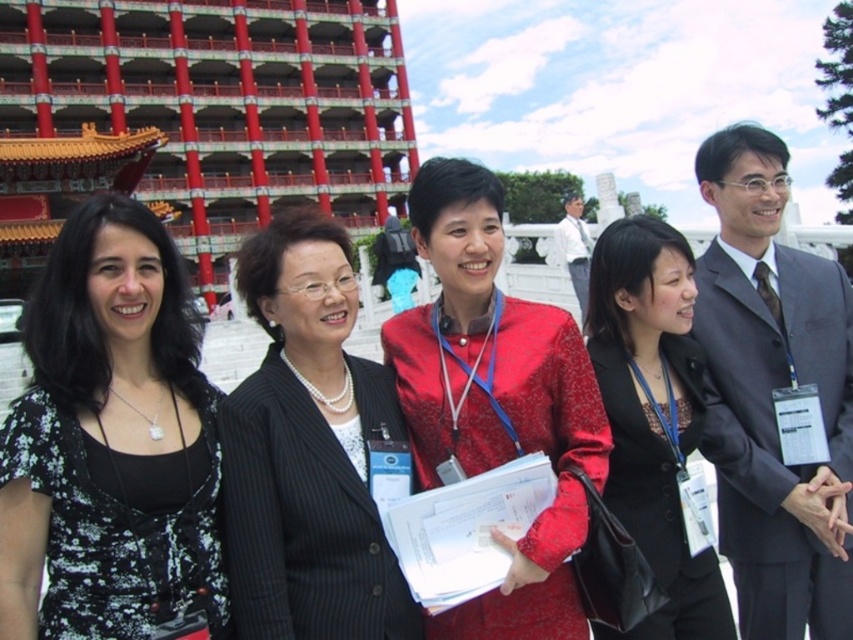
Question: In this image, where is black floral dress at left located relative to black glossy blazer at center?

Choices:
 (A) below
 (B) above

Answer: (B)

Question: From the image, what is the correct spatial relationship of red painted stone palace at upper left in relation to black floral dress at left?

Choices:
 (A) right
 (B) left

Answer: (B)

Question: Which of the following is the farthest from the observer?

Choices:
 (A) matte red dress at center
 (B) red painted stone palace at upper left
 (C) black pinstripe blazer at center

Answer: (B)

Question: Observing the image, what is the correct spatial positioning of black pinstripe blazer at center in reference to matte red dress at center?

Choices:
 (A) above
 (B) below

Answer: (A)

Question: Which object appears farthest from the camera in this image?

Choices:
 (A) matte red dress at center
 (B) black pinstripe blazer at center

Answer: (A)

Question: Which of the following is the closest to the observer?

Choices:
 (A) black glossy blazer at center
 (B) matte red dress at center

Answer: (A)